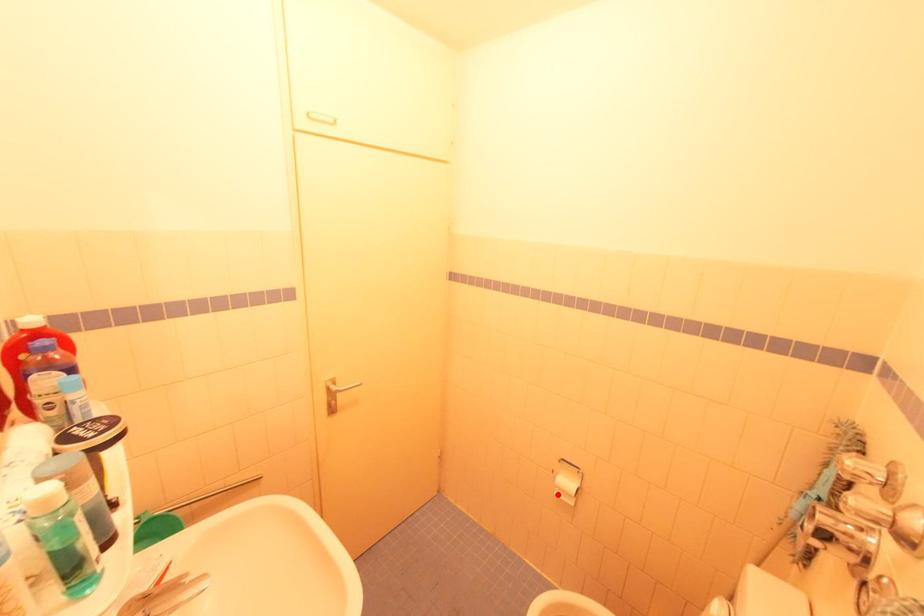
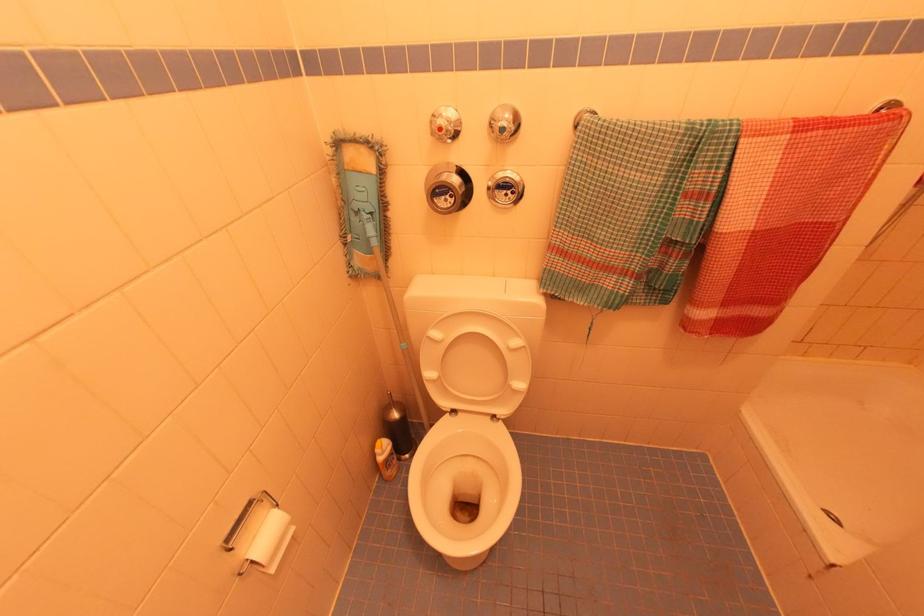
Where in the second image is the point corresponding to the highlighted location from the first image?

(274, 570)